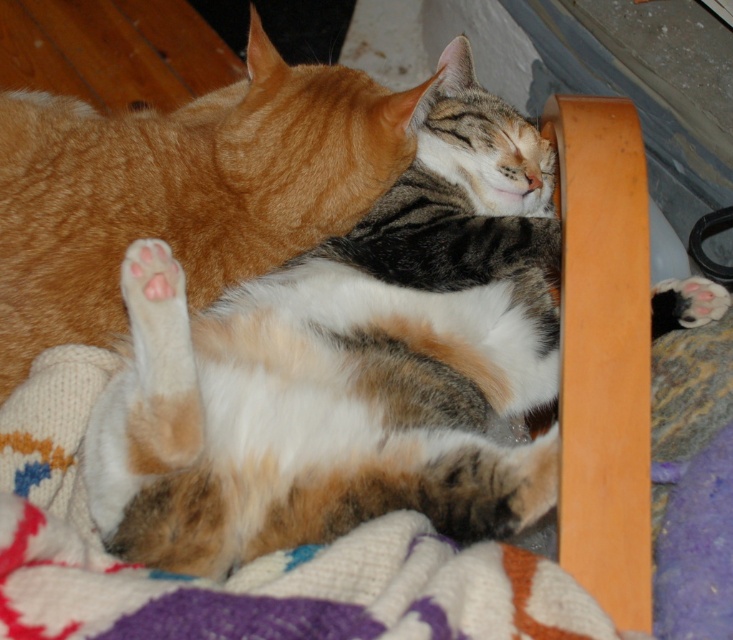
Question: From the image, what is the correct spatial relationship of orange tabby cat at upper center in relation to pink soft fur paw at lower left?

Choices:
 (A) above
 (B) below

Answer: (A)

Question: Is pink soft fur paw at lower left bigger than white fur paw at lower right?

Choices:
 (A) no
 (B) yes

Answer: (A)

Question: Can you confirm if pink soft fur paw at lower left is positioned below white fur paw at lower right?

Choices:
 (A) no
 (B) yes

Answer: (A)

Question: Estimate the real-world distances between objects in this image. Which object is farther from the white fur paw at lower right?

Choices:
 (A) orange tabby cat at upper center
 (B) pink soft fur paw at lower left

Answer: (A)

Question: Which object is positioned closest to the pink soft fur paw at lower left?

Choices:
 (A) white fur paw at lower right
 (B) orange tabby cat at upper center

Answer: (B)

Question: Among these points, which one is nearest to the camera?

Choices:
 (A) (682, 285)
 (B) (128, 284)

Answer: (B)